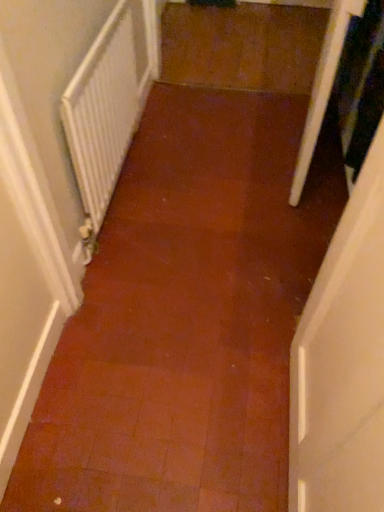
Image resolution: width=384 pixels, height=512 pixels. Describe the element at coordinates (106, 108) in the screenshot. I see `white textured radiator at left` at that location.

Where is `white textured radiator at left`? Image resolution: width=384 pixels, height=512 pixels. white textured radiator at left is located at coordinates (106, 108).

The image size is (384, 512). What do you see at coordinates (323, 87) in the screenshot? I see `transparent plastic screen door at right` at bounding box center [323, 87].

At what (x,y) coordinates should I click in order to perform the action: click on transparent plastic screen door at right. Please return your answer as a coordinate pair (x, y). Image resolution: width=384 pixels, height=512 pixels. Looking at the image, I should click on (323, 87).

The image size is (384, 512). Find the location of `white textured radiator at left`. white textured radiator at left is located at coordinates (106, 108).

Which object is positioned more to the right, white textured radiator at left or transparent plastic screen door at right?

transparent plastic screen door at right.

Considering the positions of objects white textured radiator at left and transparent plastic screen door at right in the image provided, who is behind, white textured radiator at left or transparent plastic screen door at right?

Positioned behind is transparent plastic screen door at right.

Does point (91, 203) lie in front of point (302, 172)?

Yes, point (91, 203) is closer to viewer.

From the image's perspective, is white textured radiator at left over transparent plastic screen door at right?

No, from the image's perspective, white textured radiator at left is not above transparent plastic screen door at right.

From a real-world perspective, who is located higher, white textured radiator at left or transparent plastic screen door at right?

transparent plastic screen door at right.

Which object is wider, white textured radiator at left or transparent plastic screen door at right?

Wider between the two is transparent plastic screen door at right.

Can you confirm if white textured radiator at left is shorter than transparent plastic screen door at right?

Yes.

Which of these two, white textured radiator at left or transparent plastic screen door at right, is bigger?

transparent plastic screen door at right.

Choose the correct answer: Is white textured radiator at left inside transparent plastic screen door at right or outside it?

The correct answer is: outside.

Is white textured radiator at left placed right next to transparent plastic screen door at right?

No, white textured radiator at left is not next to transparent plastic screen door at right.

Is white textured radiator at left looking in the opposite direction of transparent plastic screen door at right?

No.

Where is `radiator below the transparent plastic screen door at right (from a real-world perspective)`? radiator below the transparent plastic screen door at right (from a real-world perspective) is located at coordinates pos(106,108).

Visually, is transparent plastic screen door at right positioned to the left or to the right of white textured radiator at left?

In the image, transparent plastic screen door at right appears on the right side of white textured radiator at left.

Is transparent plastic screen door at right closer to camera compared to white textured radiator at left?

No, transparent plastic screen door at right is behind white textured radiator at left.

Is point (323, 41) positioned in front of point (85, 127)?

That is False.

From the image's perspective, which one is positioned lower, transparent plastic screen door at right or white textured radiator at left?

white textured radiator at left is shown below in the image.

In the scene shown: From a real-world perspective, is transparent plastic screen door at right physically above white textured radiator at left?

Indeed, from a real-world perspective, transparent plastic screen door at right stands above white textured radiator at left.

Based on the photo, considering the sizes of objects transparent plastic screen door at right and white textured radiator at left in the image provided, who is thinner, transparent plastic screen door at right or white textured radiator at left?

Thinner between the two is white textured radiator at left.

Between transparent plastic screen door at right and white textured radiator at left, which one has more height?

transparent plastic screen door at right is taller.

Considering the sizes of objects transparent plastic screen door at right and white textured radiator at left in the image provided, who is smaller, transparent plastic screen door at right or white textured radiator at left?

white textured radiator at left is smaller.

Would you say white textured radiator at left is part of transparent plastic screen door at right's contents?

No, white textured radiator at left is not surrounded by transparent plastic screen door at right.

Can you see transparent plastic screen door at right touching white textured radiator at left?

No, transparent plastic screen door at right is not in contact with white textured radiator at left.

Is transparent plastic screen door at right aimed at white textured radiator at left?

Yes.

How far apart are transparent plastic screen door at right and white textured radiator at left?

They are 29.80 inches apart.

You are a GUI agent. You are given a task and a screenshot of the screen. Output one action in this format:
    pyautogui.click(x=<x>, y=<y>)
    Task: Click on the radiator on the left of transparent plastic screen door at right
    This screenshot has height=512, width=384.
    Given the screenshot: What is the action you would take?
    pyautogui.click(x=106, y=108)

Where is `radiator on the left of transparent plastic screen door at right`? This screenshot has height=512, width=384. radiator on the left of transparent plastic screen door at right is located at coordinates (106, 108).

The width and height of the screenshot is (384, 512). What are the coordinates of `screen door above the white textured radiator at left (from a real-world perspective)` in the screenshot? It's located at (323, 87).